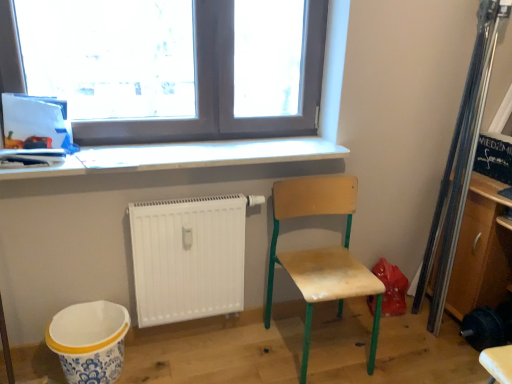
You are a GUI agent. You are given a task and a screenshot of the screen. Output one action in this format:
    pyautogui.click(x=<x>, y=<y>)
    Task: Click on the vacant space underneath wooden chair at lower right (from a real-world perspective)
    
    Given the screenshot: What is the action you would take?
    pyautogui.click(x=322, y=347)